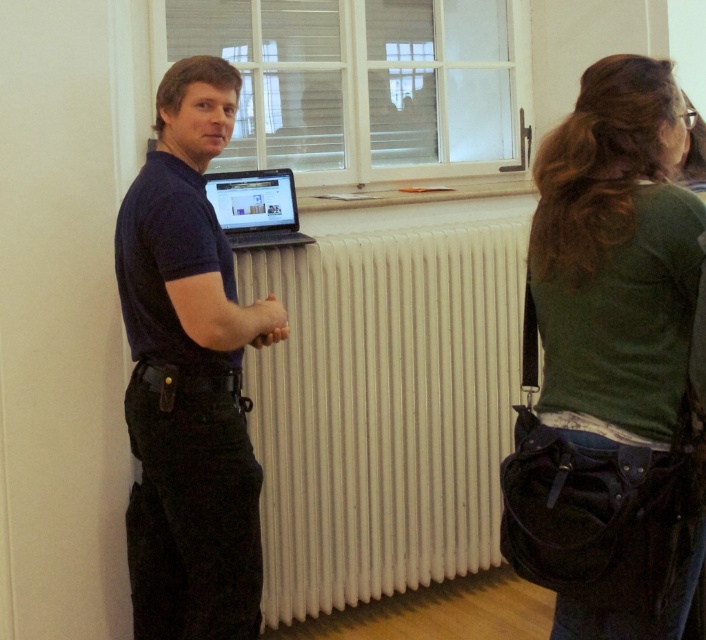
Does green fabric shirt at upper right come behind white ribbed radiator at center?

No, it is not.

Between green fabric shirt at upper right and white ribbed radiator at center, which one is positioned higher?

green fabric shirt at upper right

Where is `green fabric shirt at upper right`? Image resolution: width=706 pixels, height=640 pixels. green fabric shirt at upper right is located at coordinates (611, 365).

Which is below, green fabric shirt at upper right or matte black laptop at center?

Positioned lower is green fabric shirt at upper right.

Between green fabric shirt at upper right and matte black laptop at center, which one is positioned higher?

Positioned higher is matte black laptop at center.

Is point (614, 312) farther from viewer compared to point (265, 177)?

No, it is not.

In order to click on green fabric shirt at upper right in this screenshot , I will do `click(611, 365)`.

Does point (184, 93) come closer to viewer compared to point (293, 188)?

Yes, point (184, 93) is closer to viewer.

Between point (251, 600) and point (268, 193), which one is positioned behind?

Point (268, 193)

Find the location of a particular element. This screenshot has width=706, height=640. dark blue shirt at center is located at coordinates point(189,376).